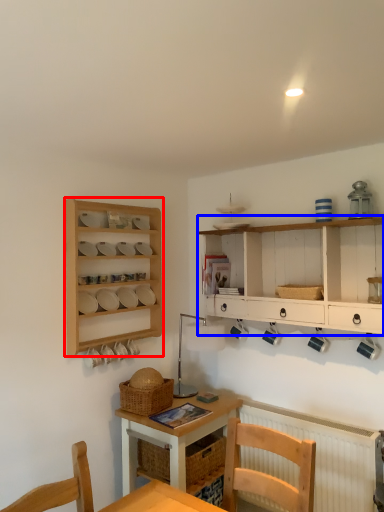
Question: Which object appears farthest to the camera in this image, shelf (highlighted by a red box) or cabinetry (highlighted by a blue box)?

Choices:
 (A) shelf
 (B) cabinetry

Answer: (A)